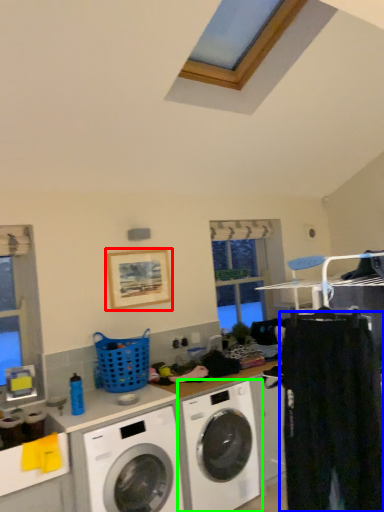
Question: Which is nearer to the picture frame (highlighted by a red box)? clothing (highlighted by a blue box) or washing machine (highlighted by a green box).

Choices:
 (A) clothing
 (B) washing machine

Answer: (B)